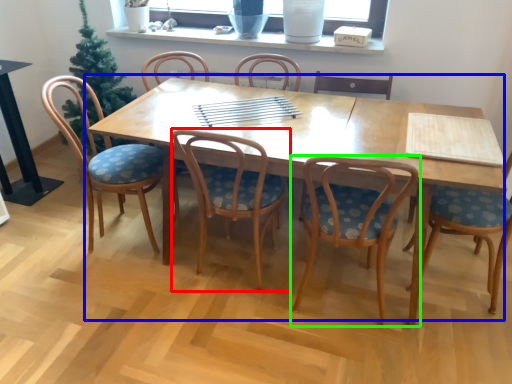
Question: Which object is positioned farthest from chair (highlighted by a red box)? Select from kitchen & dining room table (highlighted by a blue box) and chair (highlighted by a green box).

Choices:
 (A) kitchen & dining room table
 (B) chair

Answer: (B)